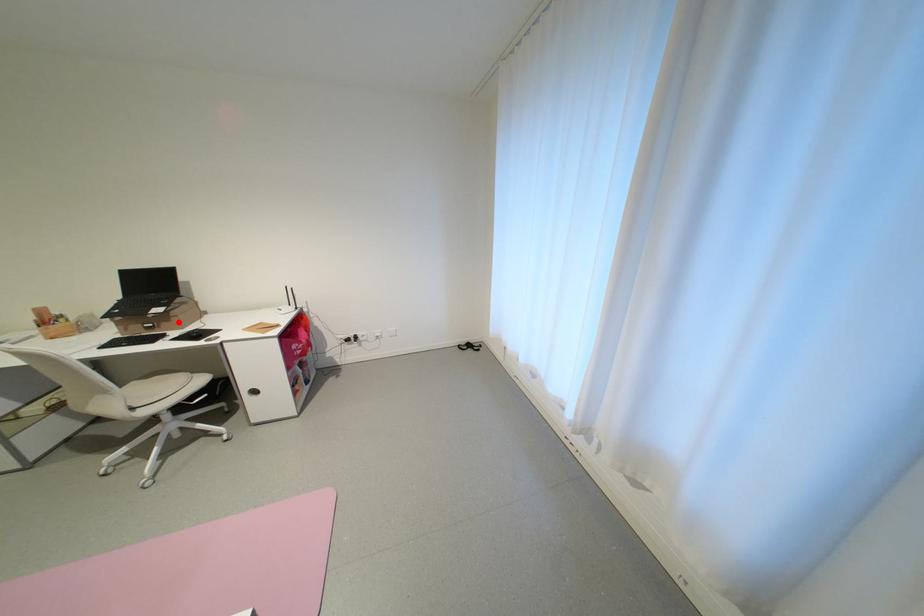
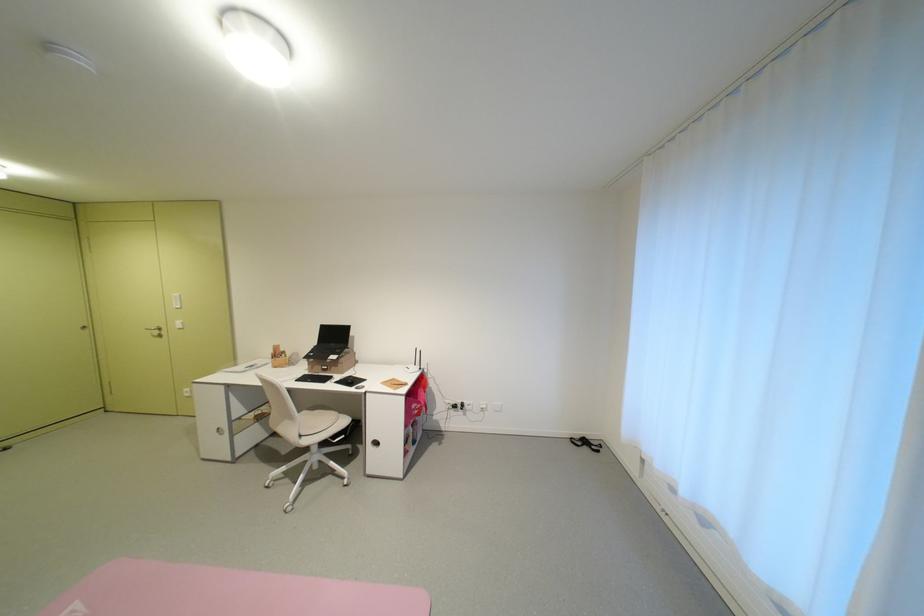
Where in the second image is the point corresponding to the highlighted location from the first image?

(346, 368)